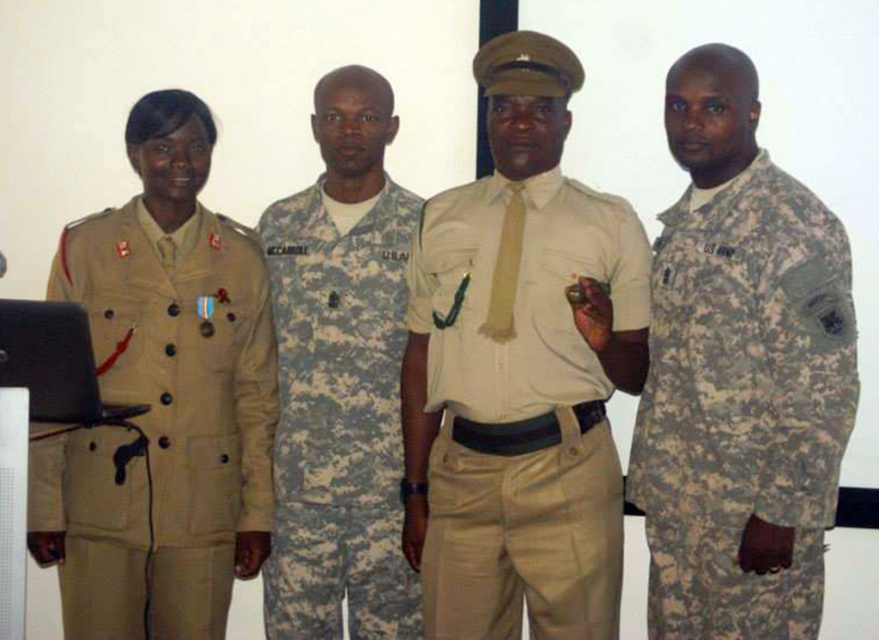
Question: Is the position of beige uniform at center less distant than that of tan fabric uniform at left?

Choices:
 (A) no
 (B) yes

Answer: (B)

Question: Which object is farther from the camera taking this photo?

Choices:
 (A) camouflage fabric uniform at right
 (B) tan fabric uniform at left
 (C) beige uniform at center
 (D) digital camouflage uniform at center

Answer: (D)

Question: Does camouflage fabric uniform at right appear over tan fabric uniform at left?

Choices:
 (A) yes
 (B) no

Answer: (A)

Question: In this image, where is beige uniform at center located relative to camouflage fabric uniform at right?

Choices:
 (A) right
 (B) left

Answer: (B)

Question: Which object appears closest to the camera in this image?

Choices:
 (A) camouflage fabric uniform at right
 (B) tan fabric uniform at left

Answer: (A)

Question: Estimate the real-world distances between objects in this image. Which object is closer to the camouflage fabric uniform at right?

Choices:
 (A) digital camouflage uniform at center
 (B) beige uniform at center
 (C) tan fabric uniform at left

Answer: (B)